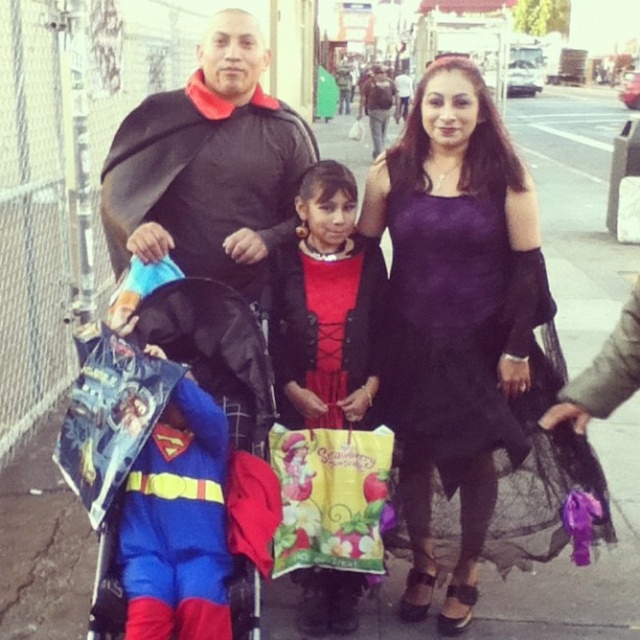
What are the coordinates of the matte purple dress at center?

The coordinates of the matte purple dress at center are at point (326, 307).

You are a photographer who needs to adjust the lighting to ensure both the purple satin dress at center and the matte purple dress at center are visible. Which dress should you focus on first to avoid shadows?

The purple satin dress at center is in front of the matte purple dress at center, so you should focus on adjusting the lighting for the purple satin dress at center first to avoid its shadow from obscuring the matte purple dress at center.